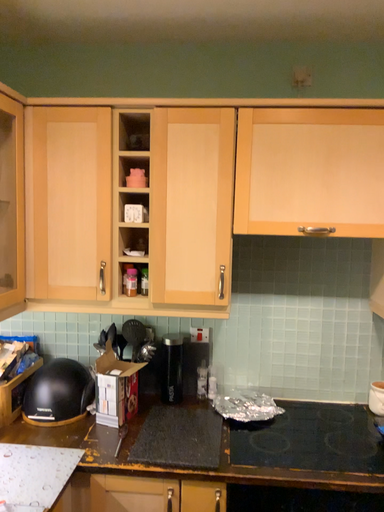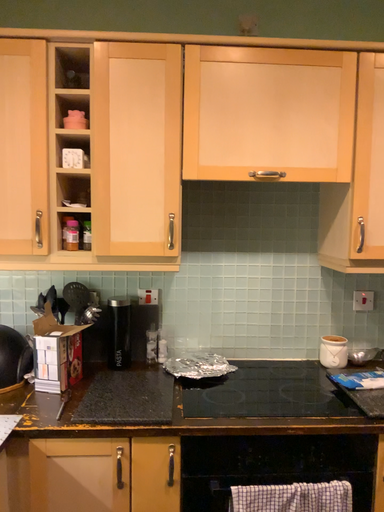
Question: Which way did the camera rotate in the video?

Choices:
 (A) rotated right
 (B) rotated left

Answer: (A)